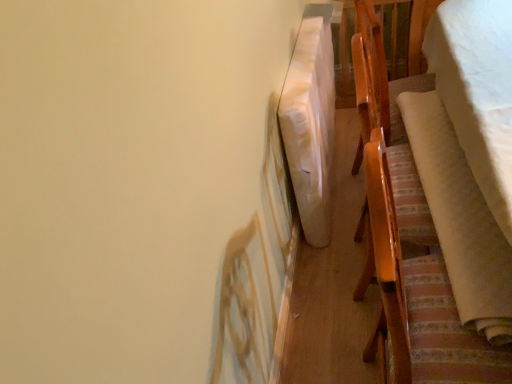
Question: Is white soft blanket at right, which ranks as the 2th blanket in right-to-left order, located within white fabric blanket at upper right, the 3th blanket viewed from the right?

Choices:
 (A) no
 (B) yes

Answer: (A)

Question: From the image's perspective, is white fabric blanket at upper right, which is the first blanket in left-to-right order, below white soft blanket at right, which ranks as the 2th blanket in right-to-left order?

Choices:
 (A) no
 (B) yes

Answer: (A)

Question: Is white fabric blanket at upper right, the 3th blanket viewed from the right, oriented towards white soft blanket at right, which ranks as the 2th blanket in right-to-left order?

Choices:
 (A) no
 (B) yes

Answer: (B)

Question: Is white fabric blanket at upper right, which is the first blanket in left-to-right order, taller than white soft blanket at right, the second blanket when ordered from left to right?

Choices:
 (A) no
 (B) yes

Answer: (B)

Question: From a real-world perspective, is white fabric blanket at upper right, the 3th blanket viewed from the right, physically below white soft blanket at right, which ranks as the 2th blanket in right-to-left order?

Choices:
 (A) no
 (B) yes

Answer: (B)

Question: In the image, is white soft blanket at right, the 1th blanket positioned from the right, positioned in front of or behind white soft blanket at right, the second blanket when ordered from left to right?

Choices:
 (A) behind
 (B) front

Answer: (B)

Question: Considering the positions of white soft blanket at right, the 1th blanket positioned from the right, and white soft blanket at right, which ranks as the 2th blanket in right-to-left order, in the image, is white soft blanket at right, the 1th blanket positioned from the right, wider or thinner than white soft blanket at right, which ranks as the 2th blanket in right-to-left order,?

Choices:
 (A) wide
 (B) thin

Answer: (A)

Question: Choose the correct answer: Is white soft blanket at right, acting as the 3th blanket starting from the left, inside white soft blanket at right, the second blanket when ordered from left to right, or outside it?

Choices:
 (A) inside
 (B) outside

Answer: (B)

Question: Is white soft blanket at right, acting as the 3th blanket starting from the left, taller or shorter than white soft blanket at right, the second blanket when ordered from left to right?

Choices:
 (A) short
 (B) tall

Answer: (B)

Question: In terms of size, does white fabric blanket at upper right, which is the first blanket in left-to-right order, appear bigger or smaller than wooden chair at right?

Choices:
 (A) small
 (B) big

Answer: (A)

Question: Considering the positions of white fabric blanket at upper right, the 3th blanket viewed from the right, and wooden chair at right in the image, is white fabric blanket at upper right, the 3th blanket viewed from the right, taller or shorter than wooden chair at right?

Choices:
 (A) short
 (B) tall

Answer: (A)

Question: Is white fabric blanket at upper right, which is the first blanket in left-to-right order, inside or outside of wooden chair at right?

Choices:
 (A) outside
 (B) inside

Answer: (A)

Question: Is white fabric blanket at upper right, the 3th blanket viewed from the right, in front of or behind wooden chair at right in the image?

Choices:
 (A) front
 (B) behind

Answer: (B)

Question: Is white soft blanket at right, acting as the 3th blanket starting from the left, to the left or to the right of wooden chair at right in the image?

Choices:
 (A) left
 (B) right

Answer: (B)

Question: From a real-world perspective, is white soft blanket at right, acting as the 3th blanket starting from the left, physically located above or below wooden chair at right?

Choices:
 (A) above
 (B) below

Answer: (B)